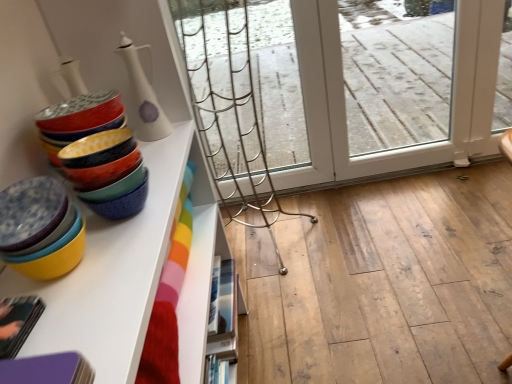
Question: Visually, is white glossy vase at upper left, acting as the second tableware starting from the front, positioned to the left or to the right of white glossy bookshelf at lower center?

Choices:
 (A) left
 (B) right

Answer: (A)

Question: Considering the positions of white glossy vase at upper left, acting as the second tableware starting from the front, and white glossy bookshelf at lower center in the image, is white glossy vase at upper left, acting as the second tableware starting from the front, wider or thinner than white glossy bookshelf at lower center?

Choices:
 (A) wide
 (B) thin

Answer: (B)

Question: Which object is the closest to the matte ceramic bowls at left, positioned as the second tableware in back-to-front order?

Choices:
 (A) white glossy bookshelf at lower center
 (B) matte ceramic bowls at left
 (C) white glossy vase at upper left, which ranks as the first tableware in top-to-bottom order

Answer: (B)

Question: Which is nearer to the matte ceramic bowls at left, which appears as the 2th tableware when viewed from the top?

Choices:
 (A) white glossy bookshelf at lower center
 (B) white glossy vase at upper left, which ranks as the first tableware in top-to-bottom order
 (C) matte ceramic bowls at left

Answer: (C)